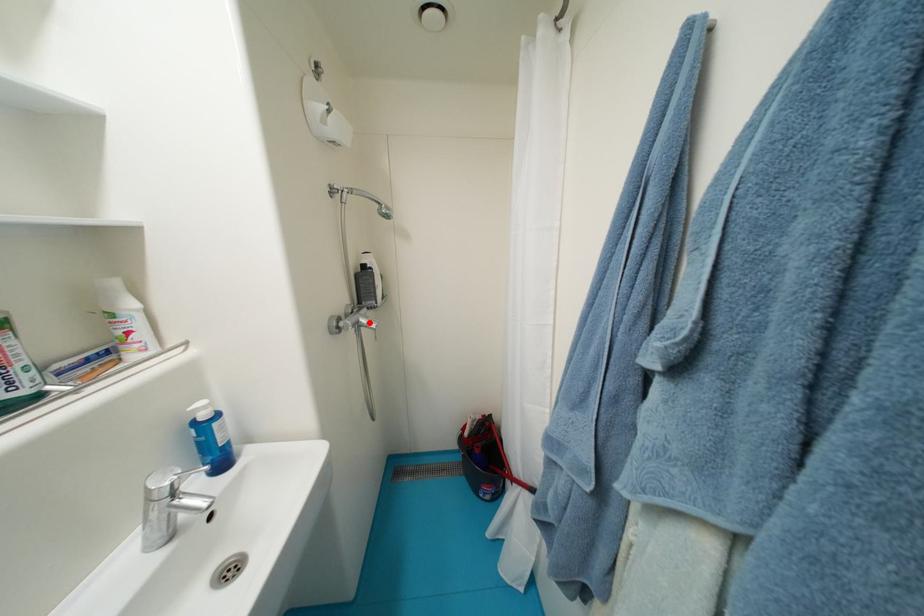
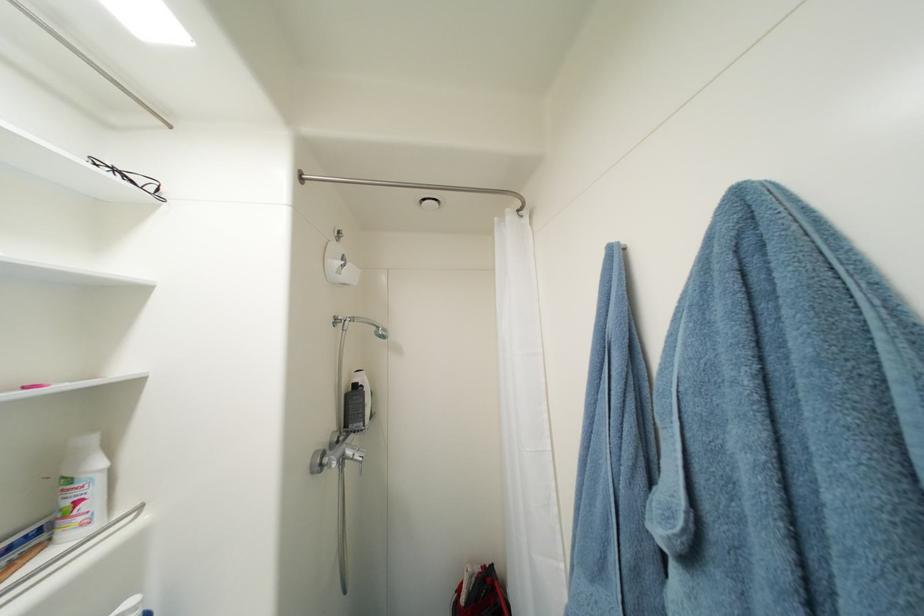
Locate, in the second image, the point that corresponds to the highlighted location in the first image.

(356, 454)